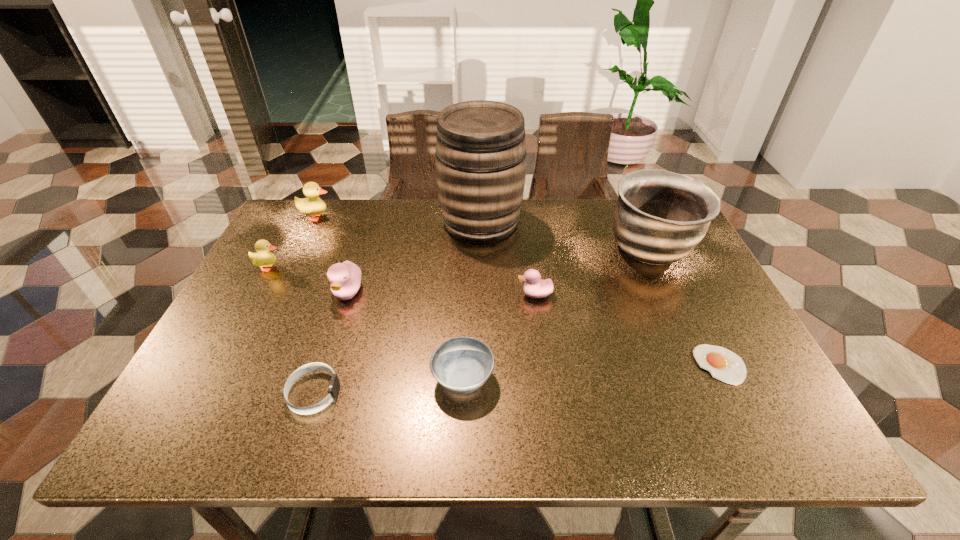
Where is `free space that is in between the bigger pink duckling and the wine bucket`? free space that is in between the bigger pink duckling and the wine bucket is located at coordinates (415, 257).

This screenshot has width=960, height=540. In order to click on free point between the nearer yellow duckling and the wristband in this screenshot , I will do `click(291, 330)`.

At what (x,y) coordinates should I click in order to perform the action: click on vacant space that is in between the pottery and the wine bucket. Please return your answer as a coordinate pair (x, y). Looking at the image, I should click on (565, 236).

The width and height of the screenshot is (960, 540). Find the location of `vacant region between the smaller yellow duckling and the fourth shortest object`. vacant region between the smaller yellow duckling and the fourth shortest object is located at coordinates (402, 281).

Locate an element on the screen. free area in between the bigger pink duckling and the pottery is located at coordinates (499, 272).

Where is `vacant area that lies between the right pink duckling and the pottery`? The height and width of the screenshot is (540, 960). vacant area that lies between the right pink duckling and the pottery is located at coordinates (592, 272).

Identify the location of vacant point located between the ashtray and the wine bucket. (471, 300).

This screenshot has width=960, height=540. What are the coordinates of `empty space that is in between the ashtray and the pottery` in the screenshot? It's located at click(557, 314).

Where is `vacant space in between the left pink duckling and the farthest duckling`? The height and width of the screenshot is (540, 960). vacant space in between the left pink duckling and the farthest duckling is located at coordinates (x=332, y=255).

The image size is (960, 540). I want to click on vacant area that lies between the tallest object and the second tallest object, so click(x=565, y=236).